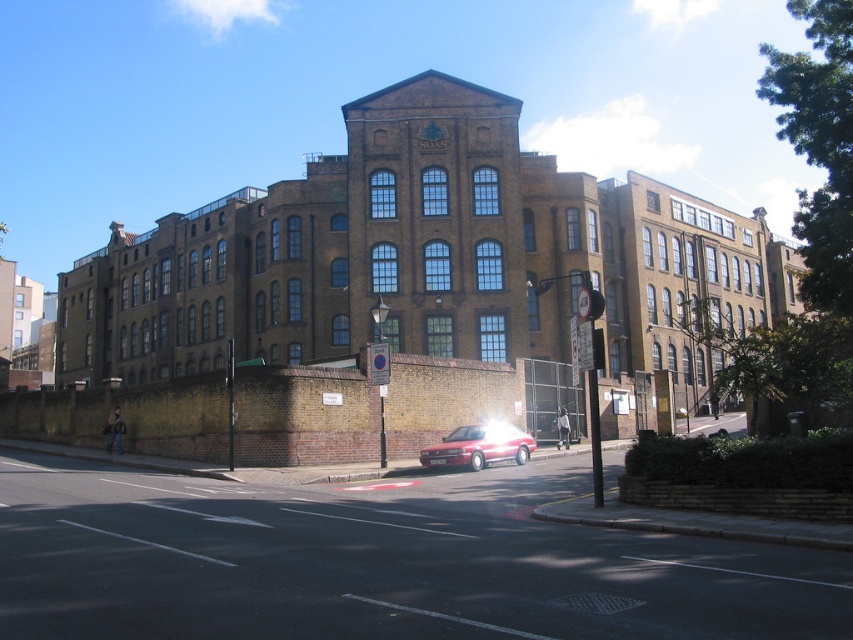
Who is positioned more to the right, black asphalt road at center or transparent glass traffic light at center?

transparent glass traffic light at center is more to the right.

Describe the element at coordinates (378, 563) in the screenshot. I see `black asphalt road at center` at that location.

Where is `black asphalt road at center`? This screenshot has height=640, width=853. black asphalt road at center is located at coordinates (378, 563).

Is point (610, 628) in front of point (495, 433)?

Yes, it is in front of point (495, 433).

Where is `black asphalt road at center`? black asphalt road at center is located at coordinates (378, 563).

Does point (453, 449) come farther from viewer compared to point (601, 333)?

Yes, point (453, 449) is behind point (601, 333).

Which is below, glossy red car at center or transparent glass traffic light at center?

glossy red car at center is lower down.

Does point (483, 458) come in front of point (596, 328)?

No, (483, 458) is behind (596, 328).

This screenshot has width=853, height=640. I want to click on glossy red car at center, so click(x=479, y=445).